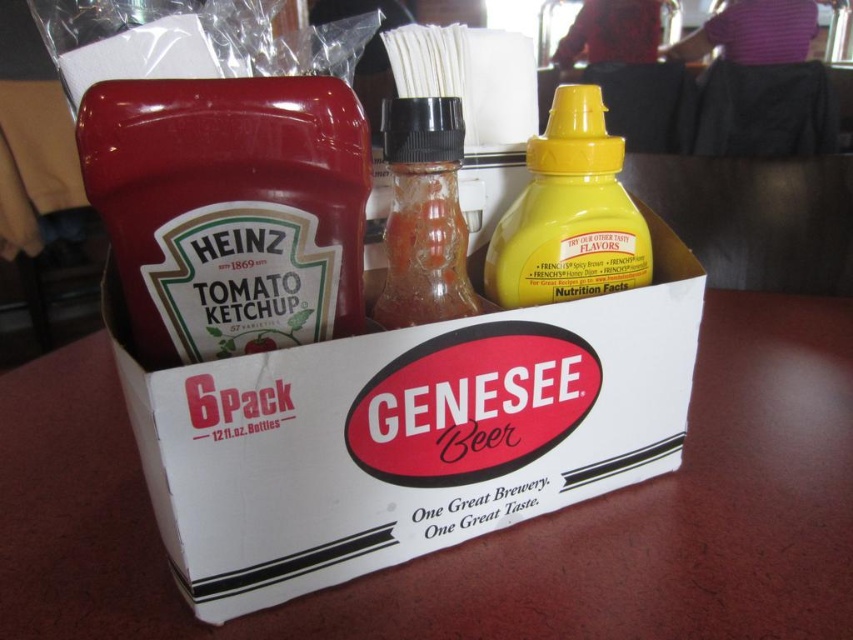
Question: Based on their relative distances, which object is farther from the translucent glass bottle at center?

Choices:
 (A) white cardboard box at center
 (B) yellow matte mustard at center

Answer: (A)

Question: Does yellow matte mustard at center have a greater width compared to translucent glass bottle at center?

Choices:
 (A) no
 (B) yes

Answer: (B)

Question: Which object is the closest to the matte glass bottle at center?

Choices:
 (A) white cardboard box at center
 (B) translucent glass bottle at center
 (C) yellow matte mustard at center

Answer: (B)

Question: Does white cardboard box at center lie in front of yellow matte mustard at center?

Choices:
 (A) yes
 (B) no

Answer: (A)

Question: Which of the following is the closest to the observer?

Choices:
 (A) (270, 147)
 (B) (396, 198)
 (C) (532, 465)
 (D) (563, 92)

Answer: (A)

Question: Can you confirm if white cardboard box at center is thinner than matte glass bottle at center?

Choices:
 (A) yes
 (B) no

Answer: (B)